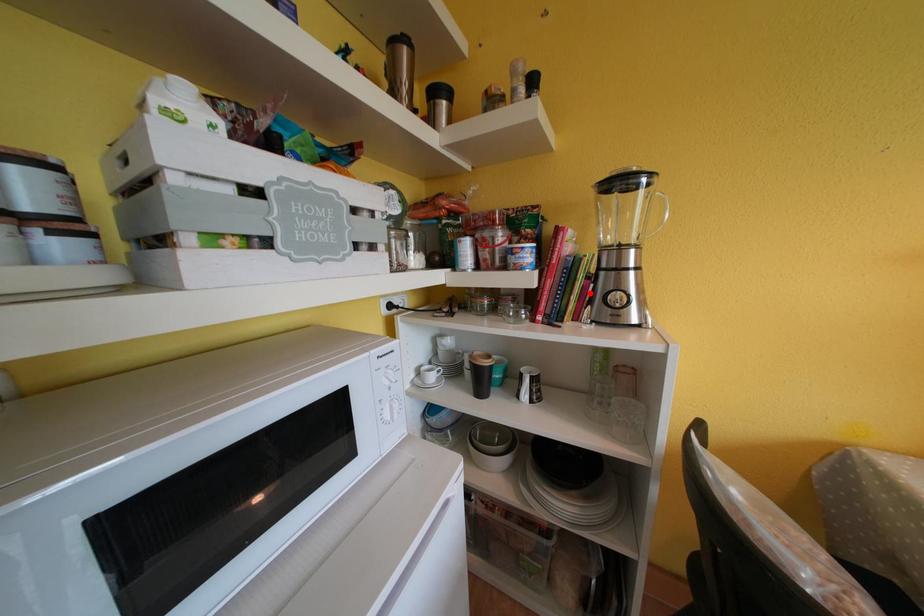
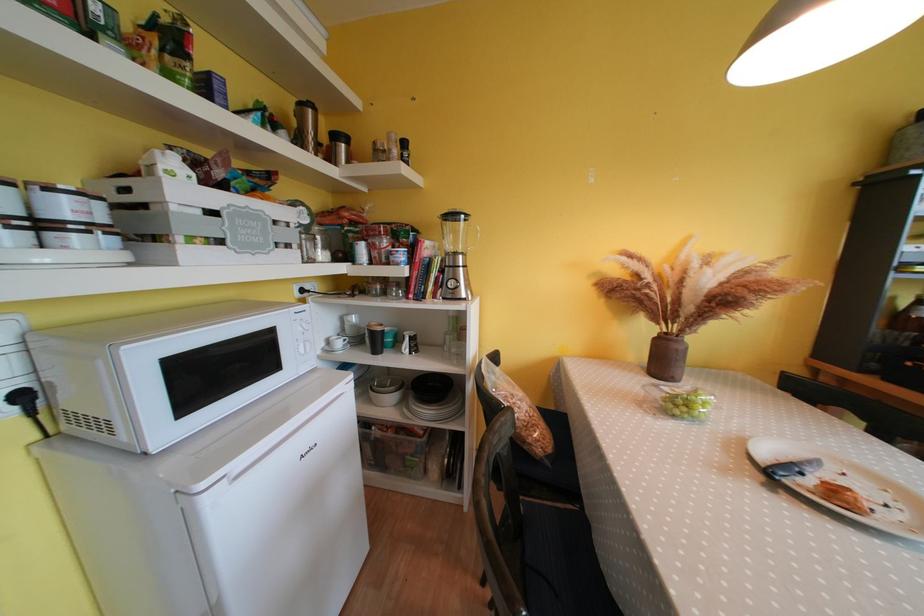
In the second image, find the point that corresponds to the highlighted location in the first image.

(444, 282)